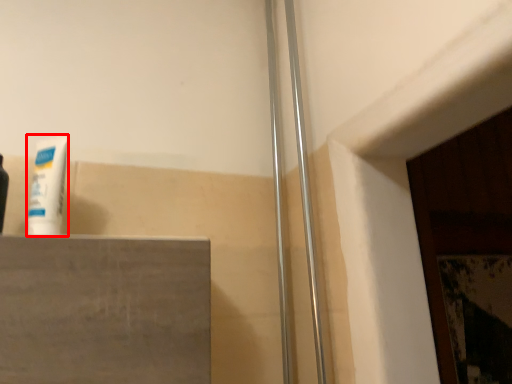
Question: Observing the image, what is the correct spatial positioning of toothpaste (annotated by the red box) in reference to shower door?

Choices:
 (A) right
 (B) left

Answer: (B)